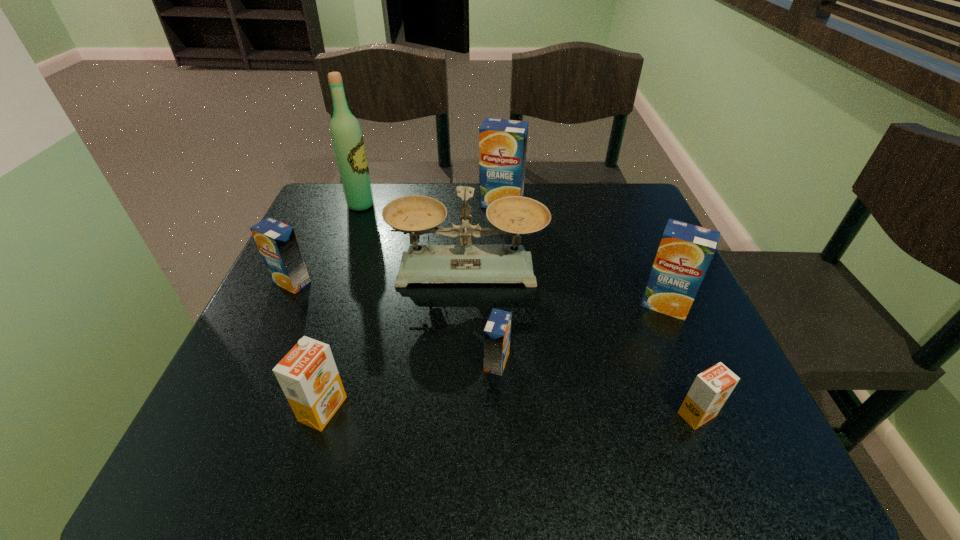
Where is `vacant space that satisfies the following two spatial constraints: 1. on the front-facing side of the wine bottle; 2. on the front side of the leftmost blue orange_juice`? Image resolution: width=960 pixels, height=540 pixels. vacant space that satisfies the following two spatial constraints: 1. on the front-facing side of the wine bottle; 2. on the front side of the leftmost blue orange_juice is located at coordinates (332, 282).

Find the location of `free point that satisfies the following two spatial constraints: 1. on the front side of the right orange orange juice; 2. on the right side of the bigger orange orange juice`. free point that satisfies the following two spatial constraints: 1. on the front side of the right orange orange juice; 2. on the right side of the bigger orange orange juice is located at coordinates (322, 414).